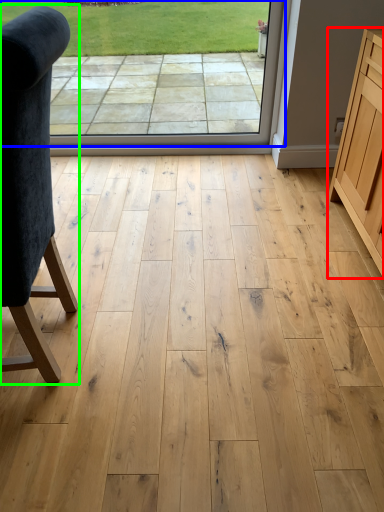
Question: Which is farther away from cabinetry (highlighted by a red box)? window screen (highlighted by a blue box) or chair (highlighted by a green box)?

Choices:
 (A) window screen
 (B) chair

Answer: (B)